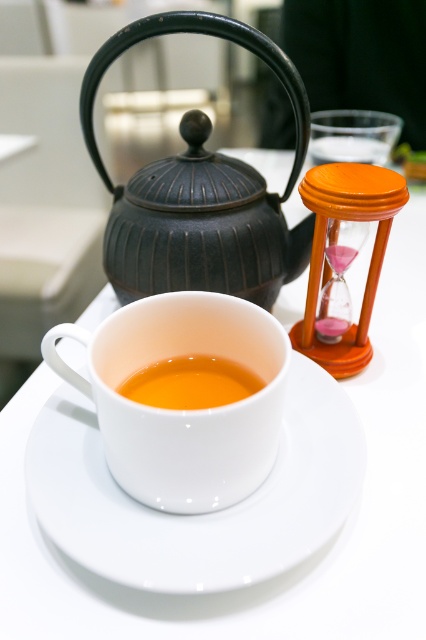
You are a tea enthusiast who wants to place a decorative coaster under the white glossy teacup at center. The coaster you have is exactly the same height as the matte black teapot at upper left. Will the coaster be taller than the teacup?

A: The matte black teapot at upper left is taller than the white glossy teacup at center. Since the coaster has the same height as the teapot, the coaster will also be taller than the teacup.

You are a tea enthusiast who wants to pour tea from the matte black teapot at upper left into the translucent glass cup at center. Considering their sizes, will the cup hold all the tea from the teapot?

The matte black teapot at upper left is wider than the translucent glass cup at center, so it is possible that the cup may not hold all the tea from the teapot depending on their capacities. However, the question only mentions width, not volume, so we cannot definitively conclude without more information about their volumes.

You are a tea enthusiast observing the serene tea setting. You notice the white glossy teacup at center. Can you determine its exact position in the image using the coordinate system provided?

The white glossy teacup at center is located at point coordinates (183, 410).